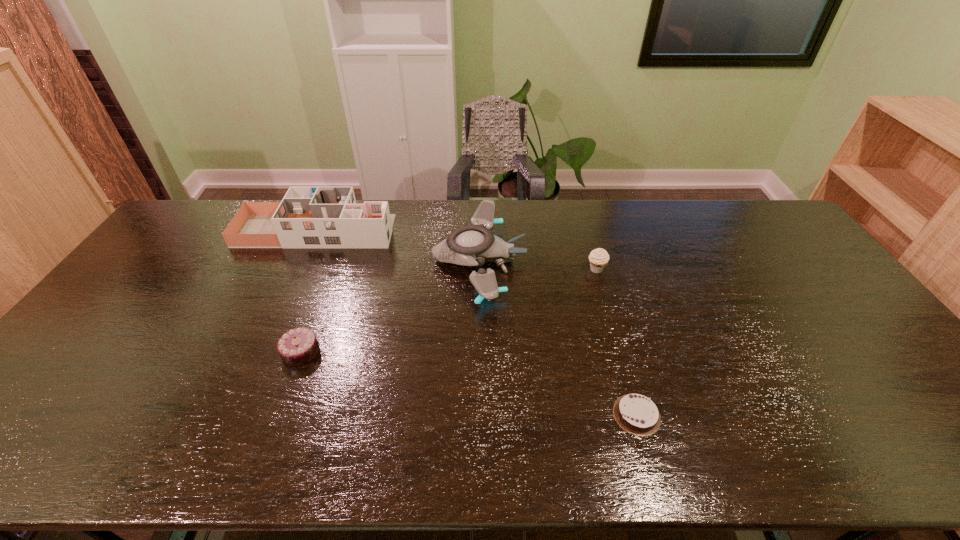
Find the location of a particular element. The width and height of the screenshot is (960, 540). free space located on the front of the muffin is located at coordinates (604, 296).

Find the location of a particular element. vacant point located on the left of the fourth tallest object is located at coordinates (164, 352).

At what (x,y) coordinates should I click in order to perform the action: click on vacant space located on the left of the right chocolate cake. Please return your answer as a coordinate pair (x, y). Image resolution: width=960 pixels, height=540 pixels. Looking at the image, I should click on (467, 415).

Image resolution: width=960 pixels, height=540 pixels. I want to click on dollhouse that is at the far edge, so click(x=307, y=217).

Image resolution: width=960 pixels, height=540 pixels. In order to click on drone located at the far edge in this screenshot , I will do `click(471, 245)`.

This screenshot has height=540, width=960. Find the location of `object present at the near edge`. object present at the near edge is located at coordinates (638, 415).

Locate an element on the screen. The image size is (960, 540). free space at the far edge of the desktop is located at coordinates (678, 208).

Where is `free space at the near edge of the desktop`? free space at the near edge of the desktop is located at coordinates (329, 435).

The width and height of the screenshot is (960, 540). Find the location of `vacant space at the left edge of the desktop`. vacant space at the left edge of the desktop is located at coordinates click(x=92, y=387).

I want to click on vacant space at the right edge, so click(927, 401).